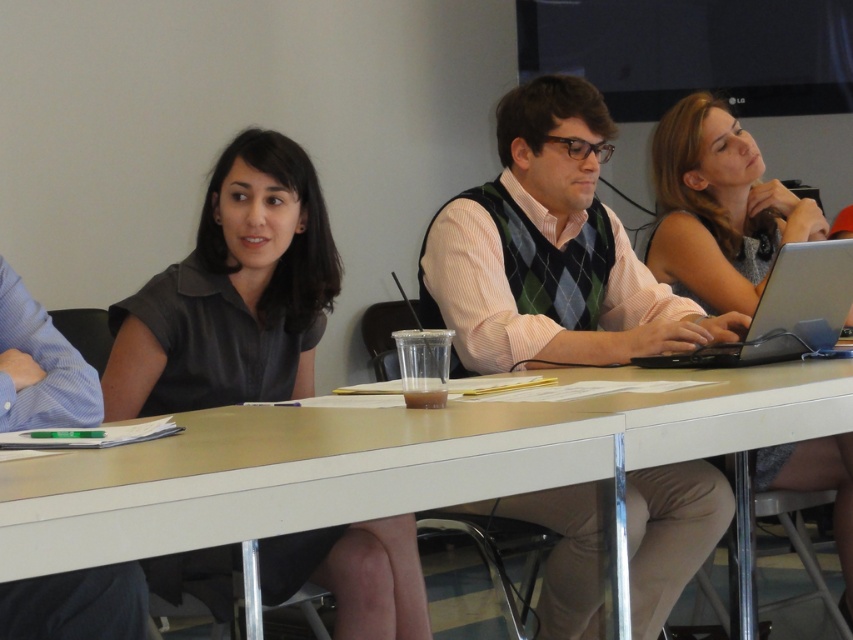
Question: Does smooth white table at center appear on the right side of green argyle sweater vest at center?

Choices:
 (A) yes
 (B) no

Answer: (B)

Question: Which object is the closest to the silver metallic laptop at right?

Choices:
 (A) smooth white table at center
 (B) dark gray shirt at center
 (C) green argyle sweater vest at center

Answer: (C)

Question: Is the position of green argyle sweater vest at center more distant than that of silver metallic laptop at right?

Choices:
 (A) yes
 (B) no

Answer: (B)

Question: Considering the real-world distances, which object is farthest from the silver metallic laptop at right?

Choices:
 (A) smooth white table at center
 (B) silver/black plastic laptop at center-right
 (C) dark gray shirt at center
 (D) green argyle sweater vest at center

Answer: (C)

Question: Can you confirm if smooth white table at center is thinner than silver/black plastic laptop at center-right?

Choices:
 (A) no
 (B) yes

Answer: (A)

Question: Which object appears closest to the camera in this image?

Choices:
 (A) smooth white table at center
 (B) silver metallic laptop at right
 (C) dark gray shirt at center
 (D) green argyle sweater vest at center

Answer: (A)